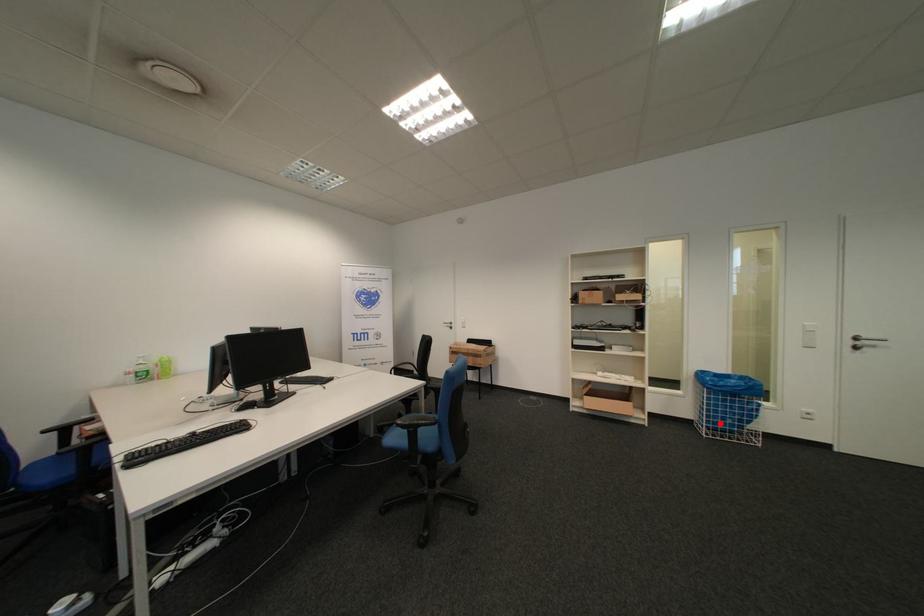
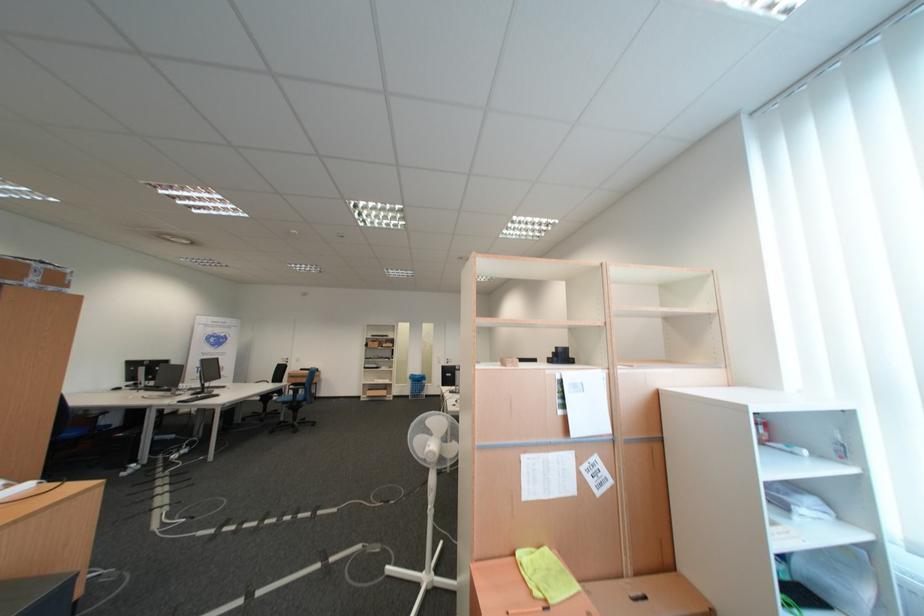
Question: I am providing you with two images of the same scene from different viewpoints. In image1, a red point is highlighted. Considering the same 3D point in image2, which of the following is correct?

Choices:
 (A) It is closer
 (B) It is farther

Answer: (B)